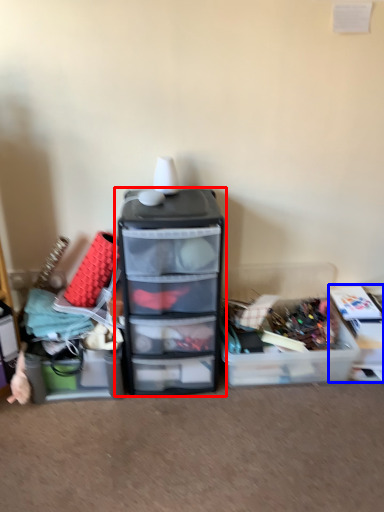
Question: Which point is closer to the camera, furniture (highlighted by a red box) or storage box (highlighted by a blue box)?

Choices:
 (A) furniture
 (B) storage box

Answer: (A)